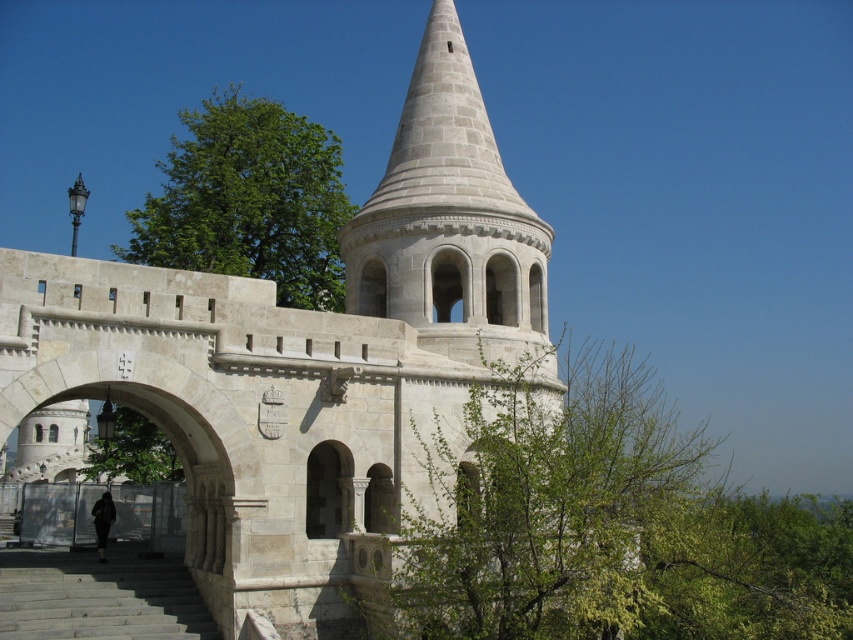
You are standing at point A, which is located at coordinates point A at (x=102, y=586). You want to walk to point B, which is 42.22 meters away from you. Given the layout of Fisherman s Bastion, is there a direct path between these two points, or will you need to navigate around any architectural features like walls or towers?

The points are 42.22 meters apart, so you will need to navigate around architectural features like walls or towers as there is no direct path available.